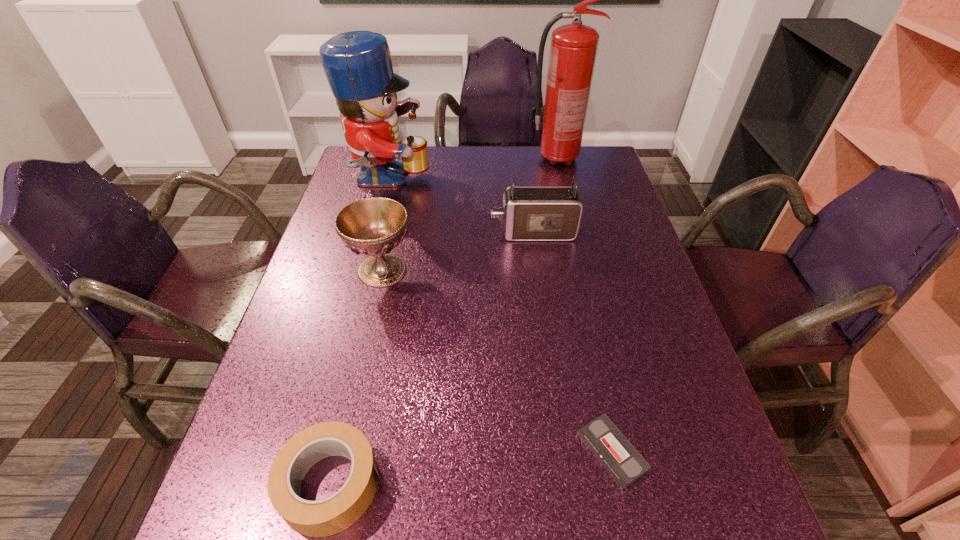
The height and width of the screenshot is (540, 960). I want to click on vacant space positioned on the right of the fourth farthest object, so click(x=526, y=270).

What are the coordinates of `free space located 0.170m at the edge of the duct tape` in the screenshot? It's located at (485, 484).

You are a GUI agent. You are given a task and a screenshot of the screen. Output one action in this format:
    pyautogui.click(x=<x>, y=<y>)
    Task: Click on the vacant point located on the back of the shortest object
    The image size is (960, 540).
    Given the screenshot: What is the action you would take?
    pyautogui.click(x=585, y=326)

The width and height of the screenshot is (960, 540). What are the coordinates of `fire extinguisher situated at the far edge` in the screenshot? It's located at (573, 50).

Find the location of a particular element. The height and width of the screenshot is (540, 960). nutcracker present at the far edge is located at coordinates (358, 66).

This screenshot has height=540, width=960. In order to click on object at the near edge in this screenshot , I will do `click(334, 514)`.

I want to click on nutcracker that is at the left edge, so click(x=358, y=66).

Locate an element on the screen. chalice at the left edge is located at coordinates (374, 226).

You are a GUI agent. You are given a task and a screenshot of the screen. Output one action in this format:
    pyautogui.click(x=<x>, y=<y>)
    Task: Click on the duct tape that is at the left edge
    
    Given the screenshot: What is the action you would take?
    pyautogui.click(x=334, y=514)

Where is `fire extinguisher present at the right edge`? fire extinguisher present at the right edge is located at coordinates (573, 50).